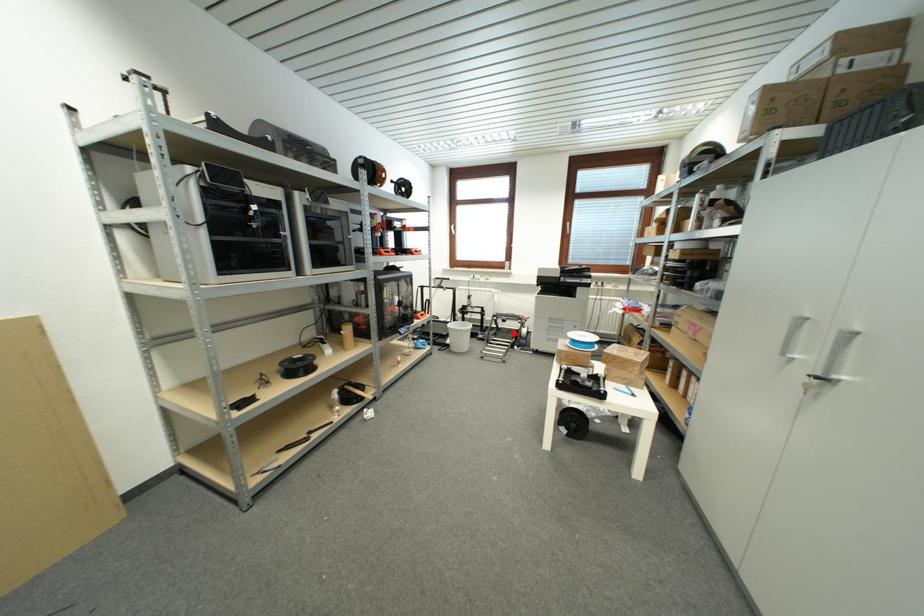
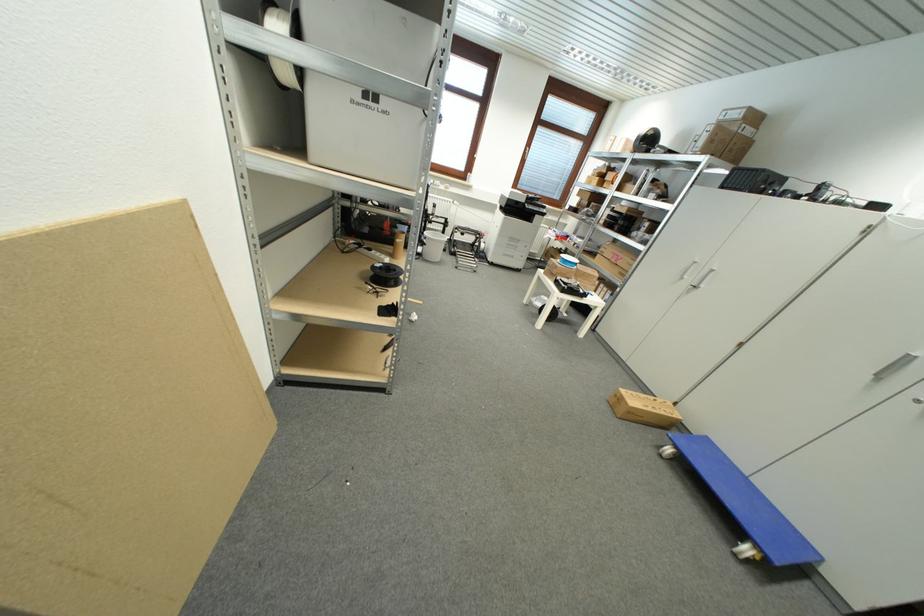
Question: I am providing you with two images of the same scene from different viewpoints. Given a red point in image1, look at the same physical point in image2. Is it:

Choices:
 (A) Closer to the viewpoint
 (B) Farther from the viewpoint

Answer: (A)